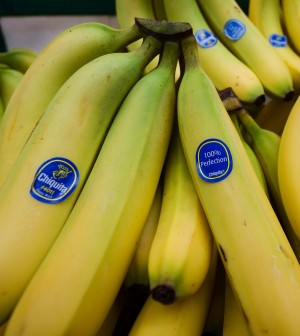
Locate an element on the screen. The width and height of the screenshot is (300, 336). stickers is located at coordinates (219, 159), (50, 182), (207, 40), (236, 28), (281, 40).